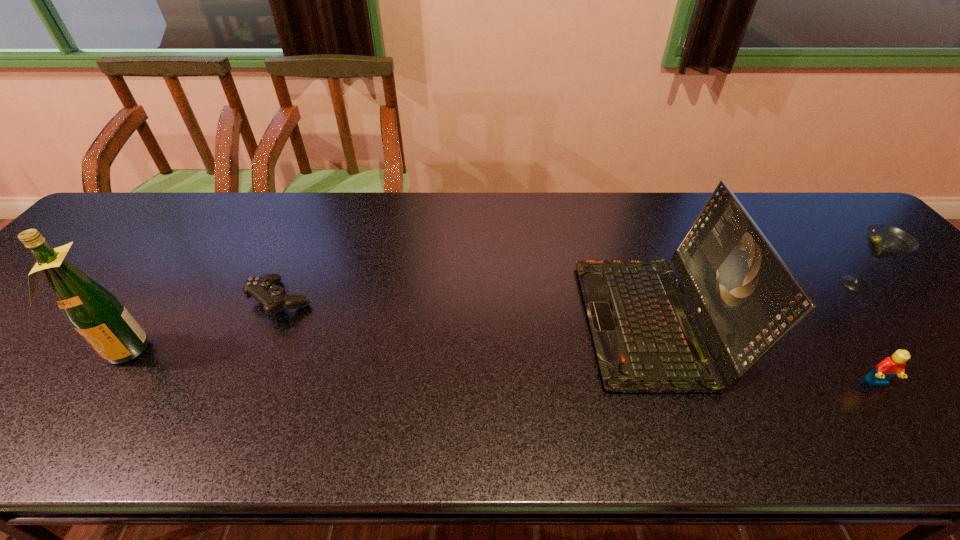
In the image, there is a desktop. Where is `vacant space at the far left corner`? This screenshot has width=960, height=540. vacant space at the far left corner is located at coordinates (132, 222).

Where is `vacant point located between the liquor and the martini`? The image size is (960, 540). vacant point located between the liquor and the martini is located at coordinates (489, 318).

This screenshot has width=960, height=540. I want to click on free space between the fourth tallest object and the shortest object, so click(x=579, y=342).

This screenshot has width=960, height=540. What are the coordinates of `vacant point located between the Lego and the shortest object` in the screenshot? It's located at (579, 342).

Identify the location of vacant space in between the rightmost object and the shortest object. The height and width of the screenshot is (540, 960). (567, 292).

You are a GUI agent. You are given a task and a screenshot of the screen. Output one action in this format:
    pyautogui.click(x=<x>, y=<y>)
    Task: Click on the vacant area between the second object from right to left and the third tallest object
    The image size is (960, 540).
    Given the screenshot: What is the action you would take?
    pyautogui.click(x=866, y=333)

Image resolution: width=960 pixels, height=540 pixels. In order to click on empty space that is in between the liquor and the shortest object in this screenshot , I will do `click(202, 326)`.

Image resolution: width=960 pixels, height=540 pixels. Identify the location of vacant area between the fourth shortest object and the tallest object. (387, 336).

Locate an element on the screen. This screenshot has height=540, width=960. free space between the second tallest object and the shortest object is located at coordinates (466, 311).

Identify which object is located as the third nearest to the leftmost object. Please provide its 2D coordinates. Your answer should be formatted as a tuple, i.e. [(x, y)], where the tuple contains the x and y coordinates of a point satisfying the conditions above.

[(889, 367)]